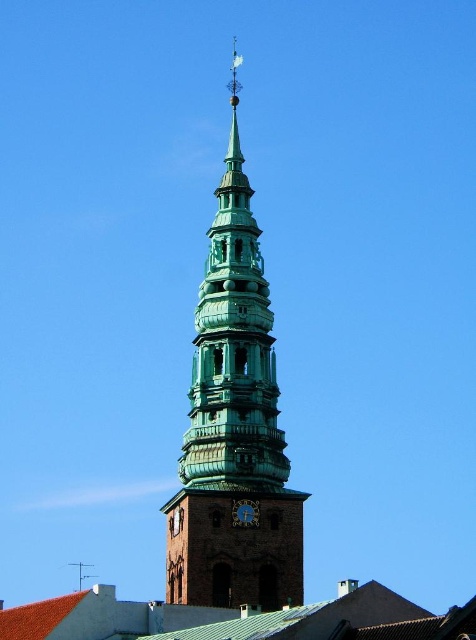
Question: Which object appears closest to the camera in this image?

Choices:
 (A) blue metallic clock at center
 (B) green patinated metal tower at center

Answer: (B)

Question: Does green patinated metal tower at center have a smaller size compared to blue metallic clock at center?

Choices:
 (A) yes
 (B) no

Answer: (B)

Question: From the image, what is the correct spatial relationship of green patinated metal tower at center in relation to blue metallic clock at center?

Choices:
 (A) left
 (B) right

Answer: (A)

Question: Is green patinated metal tower at center closer to the viewer compared to blue metallic clock at center?

Choices:
 (A) no
 (B) yes

Answer: (B)